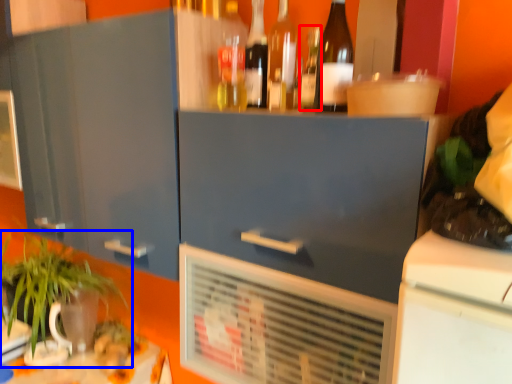
Question: Which of the following is the closest to the observer, bottle (highlighted by a red box) or houseplant (highlighted by a blue box)?

Choices:
 (A) bottle
 (B) houseplant

Answer: (A)